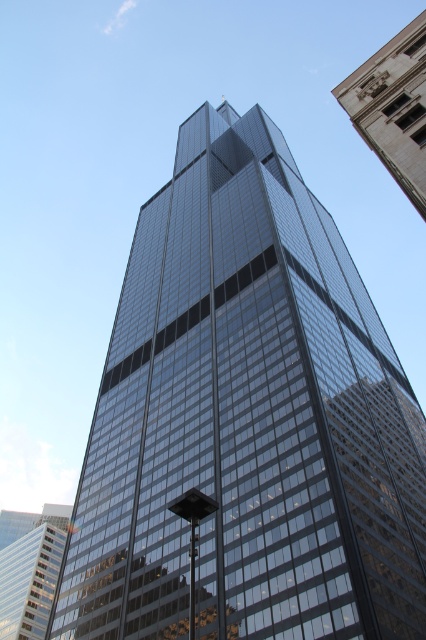
Question: Which point is closer to the camera?

Choices:
 (A) (417, 60)
 (B) (58, 564)

Answer: (A)

Question: In this image, where is white stone building at upper right located relative to glassy reflective skyscraper at center?

Choices:
 (A) right
 (B) left

Answer: (A)

Question: Which point is closer to the camera?

Choices:
 (A) 396,81
 (B) 25,547

Answer: (A)

Question: Is white stone building at upper right behind glassy reflective skyscraper at center?

Choices:
 (A) yes
 (B) no

Answer: (B)

Question: Which of the following is the closest to the observer?

Choices:
 (A) (17, 625)
 (B) (416, 61)

Answer: (B)

Question: Does white stone building at upper right have a larger size compared to glassy reflective skyscraper at center?

Choices:
 (A) yes
 (B) no

Answer: (B)